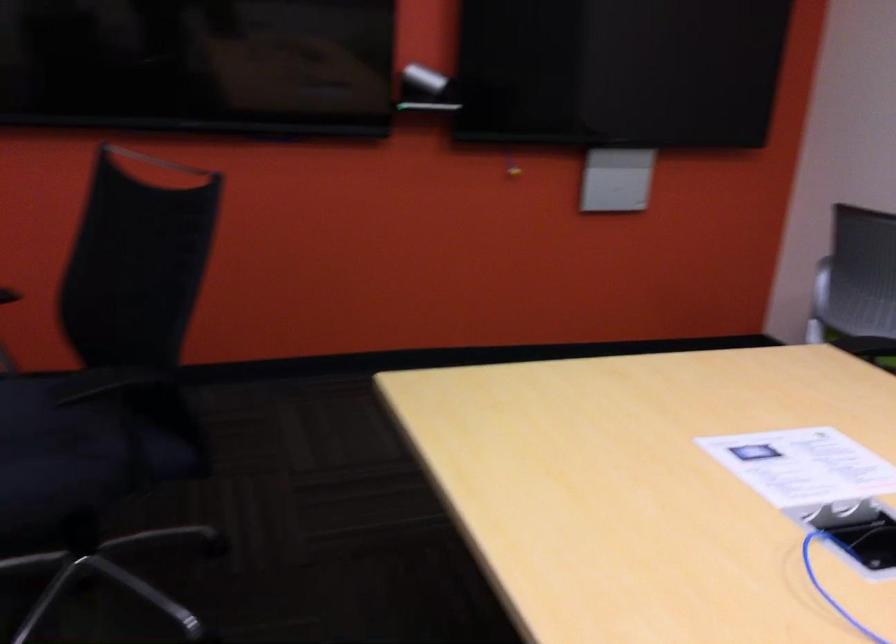
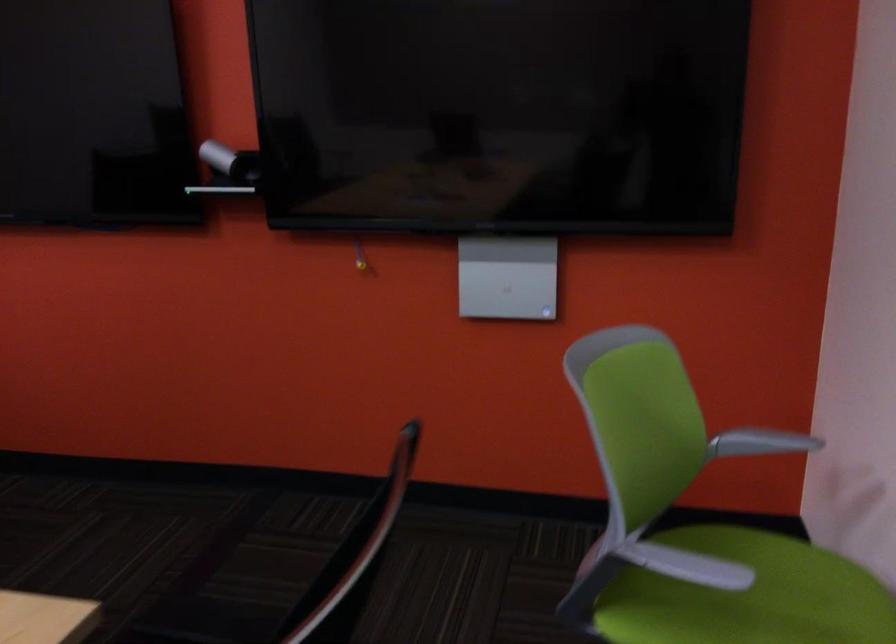
The point at (438,80) is marked in the first image. Where is the corresponding point in the second image?

(230, 162)